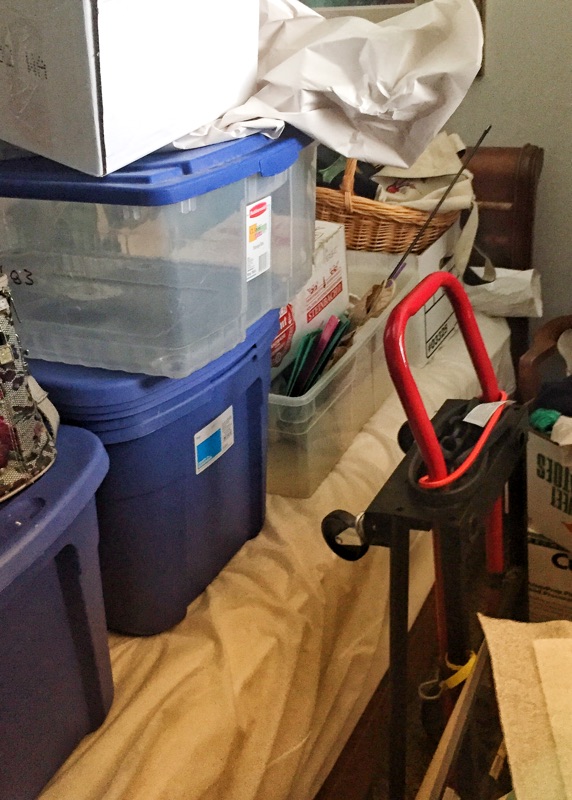
The image size is (572, 800). I want to click on plastic container with no cover, so click(333, 402).